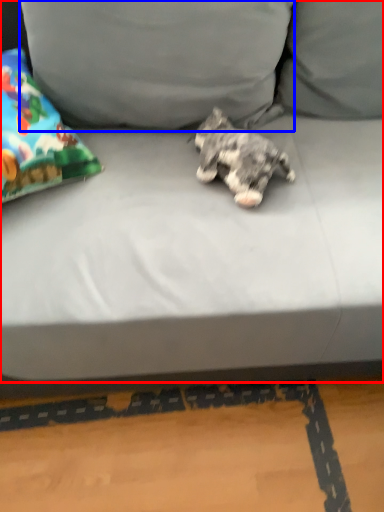
Question: Which point is closer to the camera, studio couch (highlighted by a red box) or pillow (highlighted by a blue box)?

Choices:
 (A) studio couch
 (B) pillow

Answer: (A)